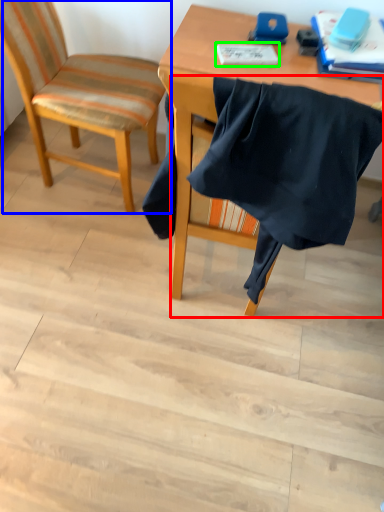
Question: Estimate the real-world distances between objects in this image. Which object is farther from chair (highlighted by a red box), chair (highlighted by a blue box) or notebook (highlighted by a green box)?

Choices:
 (A) chair
 (B) notebook

Answer: (A)